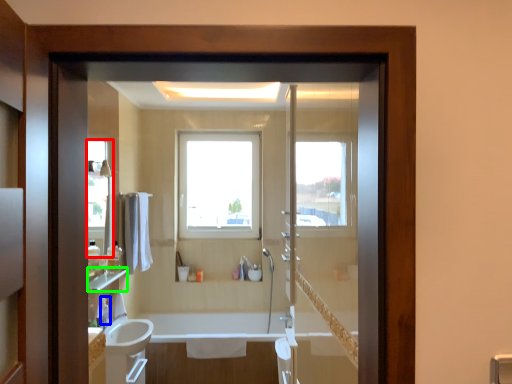
Question: Which object is positioned closest to mirror (highlighted by a red box)? Select from toiletry (highlighted by a blue box) and balustrade (highlighted by a green box).

Choices:
 (A) toiletry
 (B) balustrade

Answer: (B)